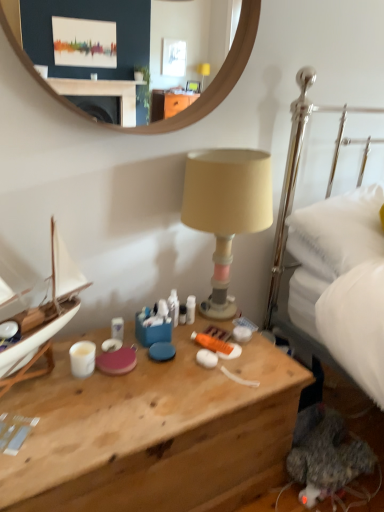
Question: In terms of height, does wooden mirror at upper center look taller or shorter compared to wooden desk at center?

Choices:
 (A) short
 (B) tall

Answer: (A)

Question: Considering the positions of wooden mirror at upper center and wooden desk at center in the image, is wooden mirror at upper center bigger or smaller than wooden desk at center?

Choices:
 (A) big
 (B) small

Answer: (B)

Question: Based on their relative distances, which object is nearer to the white soft pillow at right?

Choices:
 (A) beige fabric lampshade at center
 (B) wooden mirror at upper center
 (C) white glossy coffee cup at lower left
 (D) wooden desk at center
 (E) white plastic tube at center

Answer: (A)

Question: Which of these objects is positioned farthest from the white glossy coffee cup at lower left?

Choices:
 (A) wooden mirror at upper center
 (B) wooden desk at center
 (C) white soft pillow at right
 (D) beige fabric lampshade at center
 (E) white plastic tube at center

Answer: (A)